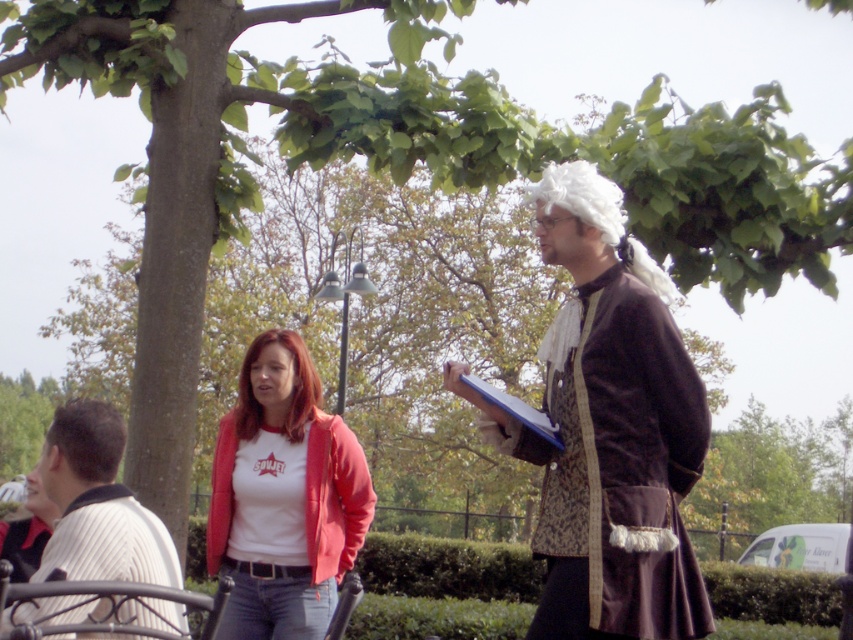
Which is behind, point (318, 573) or point (47, 433)?

Point (318, 573)

Is matte white shirt at center to the right of brown fuzzy wig at upper left from the viewer's perspective?

Yes, matte white shirt at center is to the right of brown fuzzy wig at upper left.

Find the location of a particular element. matte white shirt at center is located at coordinates (283, 497).

In order to click on matte white shirt at center in this screenshot , I will do `click(283, 497)`.

Who is taller, white textured shirt at left or white fluffy wig at upper right?

white textured shirt at left is taller.

Who is positioned more to the right, white textured shirt at left or white fluffy wig at upper right?

white fluffy wig at upper right is more to the right.

At what (x,y) coordinates should I click in order to perform the action: click on white textured shirt at left. Please return your answer as a coordinate pair (x, y). Image resolution: width=853 pixels, height=640 pixels. Looking at the image, I should click on (97, 504).

Can you confirm if brown fuzzy wig at upper left is positioned above blue paper clipboard at right?

Actually, brown fuzzy wig at upper left is below blue paper clipboard at right.

Describe the element at coordinates (88, 438) in the screenshot. I see `brown fuzzy wig at upper left` at that location.

The width and height of the screenshot is (853, 640). In order to click on brown fuzzy wig at upper left in this screenshot , I will do `click(88, 438)`.